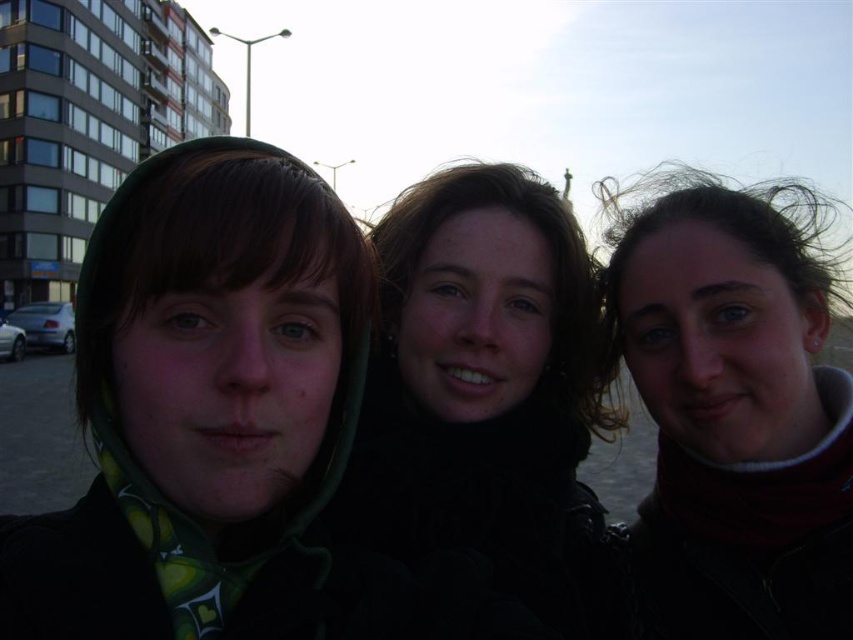
Identify the location of dark brown hair at right. The height and width of the screenshot is (640, 853). (733, 406).

Does dark brown hair at right have a lesser width compared to black matte jacket at center?

Yes, dark brown hair at right is thinner than black matte jacket at center.

Is point (688, 403) farther from viewer compared to point (465, 486)?

Yes, point (688, 403) is farther from viewer.

Locate an element on the screen. dark brown hair at right is located at coordinates (733, 406).

Can you confirm if green fabric headscarf at left is bigger than dark brown hair at right?

Actually, green fabric headscarf at left might be smaller than dark brown hair at right.

Which is above, green fabric headscarf at left or dark brown hair at right?

dark brown hair at right is above.

Does point (51, 634) come closer to viewer compared to point (781, 404)?

Yes, it is in front of point (781, 404).

I want to click on green fabric headscarf at left, so click(x=206, y=412).

Who is shorter, green fabric headscarf at left or black matte jacket at center?

green fabric headscarf at left

Can you confirm if green fabric headscarf at left is shorter than black matte jacket at center?

Yes, green fabric headscarf at left is shorter than black matte jacket at center.

Who is more distant from viewer, (341, 458) or (416, 444)?

The point (416, 444) is behind.

Where is `green fabric headscarf at left`? This screenshot has height=640, width=853. green fabric headscarf at left is located at coordinates (206, 412).